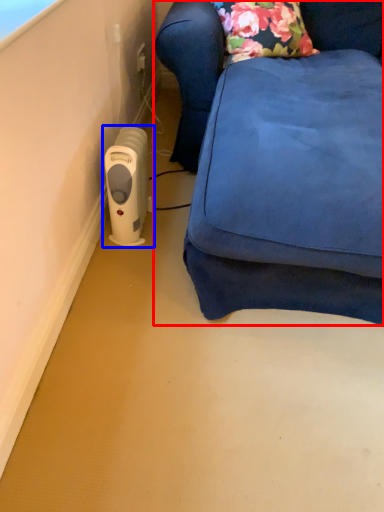
Question: Among these objects, which one is farthest to the camera, furniture (highlighted by a red box) or home appliance (highlighted by a blue box)?

Choices:
 (A) furniture
 (B) home appliance

Answer: (B)